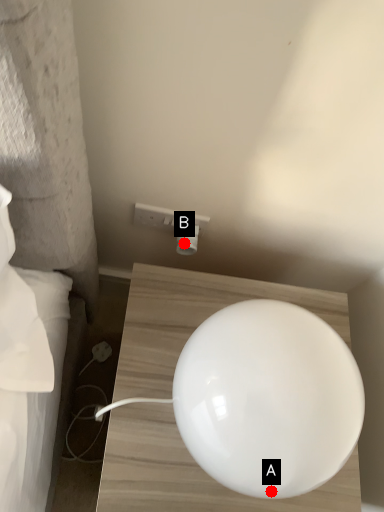
Question: Two points are circled on the image, labeled by A and B beside each circle. Which point appears farthest from the camera in this image?

Choices:
 (A) A is further
 (B) B is further

Answer: (B)